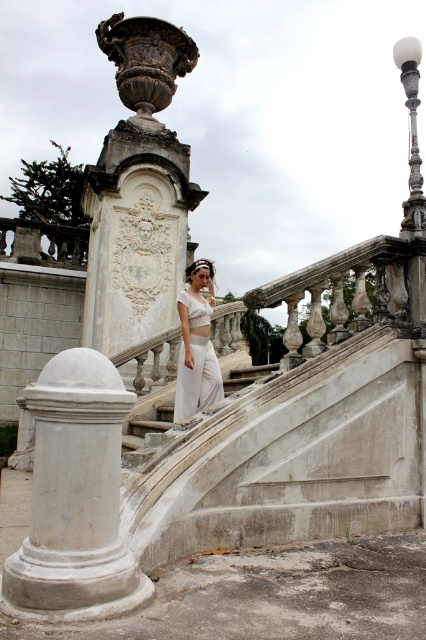
You are an architect designing a new classical garden. You want to place a statue that is 2 meters wide between the white marble vase at upper center and the white marble column at center. Is there enough space between them to fit the statue without moving either object?

The distance between the white marble vase at upper center and the white marble column at center is 13.29 meters. Since the statue is only 2 meters wide, there is more than enough space to place it between them without moving either object.

You are an architect examining this classical outdoor staircase. You notice the white marble vase at upper center and the white marble column at center. Which object is positioned higher in the scene?

The white marble vase at upper center is positioned higher than the white marble column at center.

You are a fashion designer observing a model wearing white cotton pants at center and standing on white marble stairs at center. Which item has a greater height measurement?

The white cotton pants at center is taller than the white marble stairs at center.